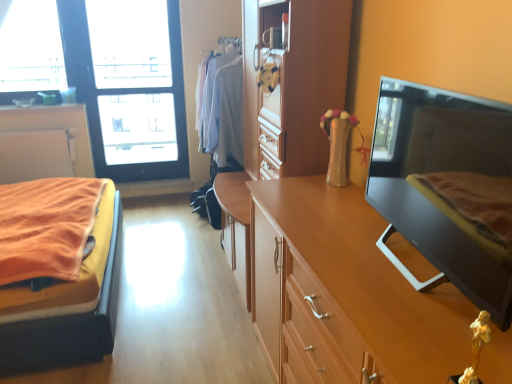
Find the location of a particular element. The width and height of the screenshot is (512, 384). vacant region to the left of black glossy tv at right is located at coordinates (349, 261).